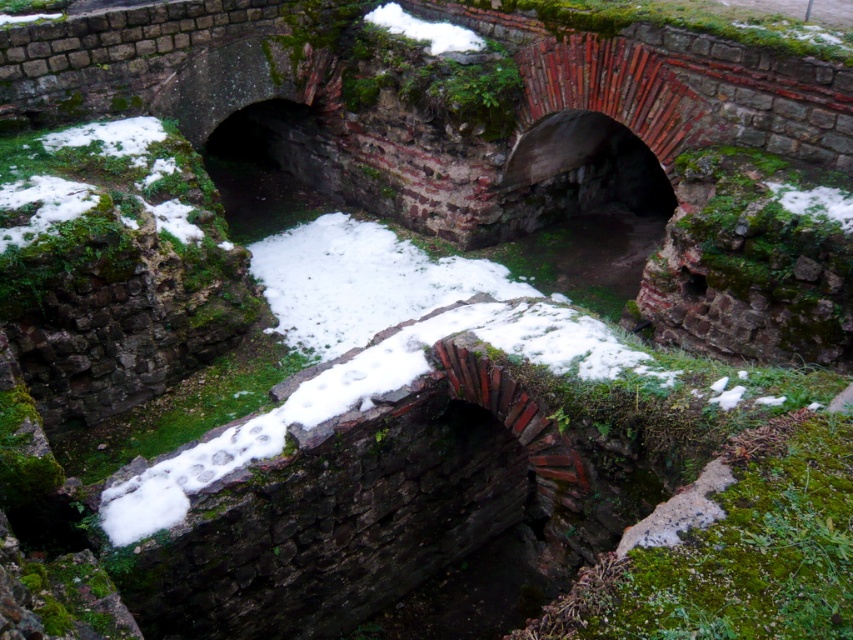
What do you see at coordinates (424, 29) in the screenshot? I see `white fluffy snow at upper center` at bounding box center [424, 29].

Is white fluffy snow at upper center below white fluffy snow at lower right?

No.

Between point (438, 51) and point (796, 188), which one is positioned behind?

The point (438, 51) is behind.

Locate an element on the screen. white fluffy snow at upper center is located at coordinates pos(424,29).

In the scene shown: Can you confirm if white fluffy snow at center is positioned above white fluffy snow at upper center?

Actually, white fluffy snow at center is below white fluffy snow at upper center.

Does white fluffy snow at center appear on the right side of white fluffy snow at upper center?

No, white fluffy snow at center is not to the right of white fluffy snow at upper center.

Who is more distant from viewer, [137,486] or [387,4]?

Point [387,4]

Find the location of a particular element. The width and height of the screenshot is (853, 640). white fluffy snow at center is located at coordinates (368, 400).

Where is `white fluffy snow at center`? white fluffy snow at center is located at coordinates (368, 400).

Is white fluffy snow at center above white fluffy snow at lower right?

No, white fluffy snow at center is not above white fluffy snow at lower right.

Describe the element at coordinates (368, 400) in the screenshot. This screenshot has height=640, width=853. I see `white fluffy snow at center` at that location.

Image resolution: width=853 pixels, height=640 pixels. Identify the location of white fluffy snow at center. (368, 400).